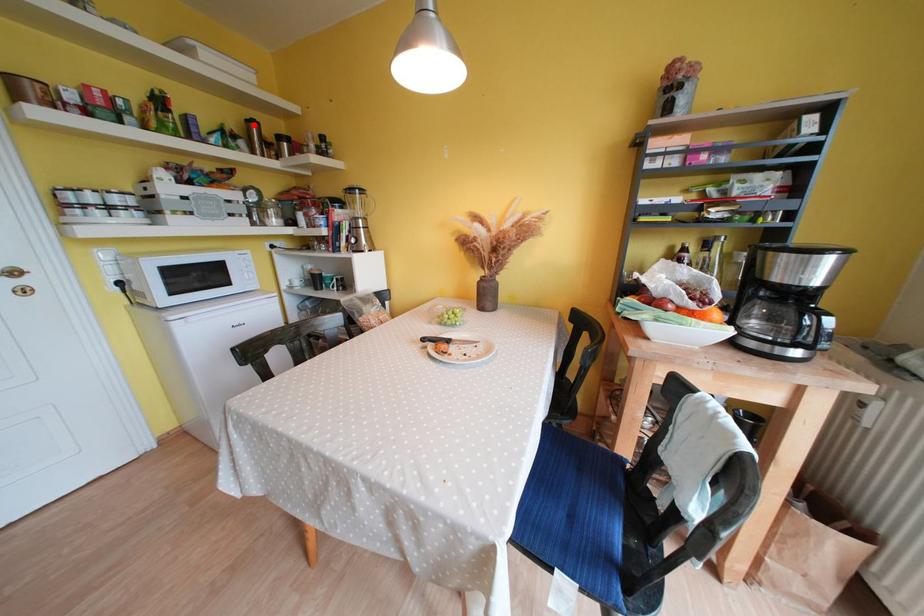
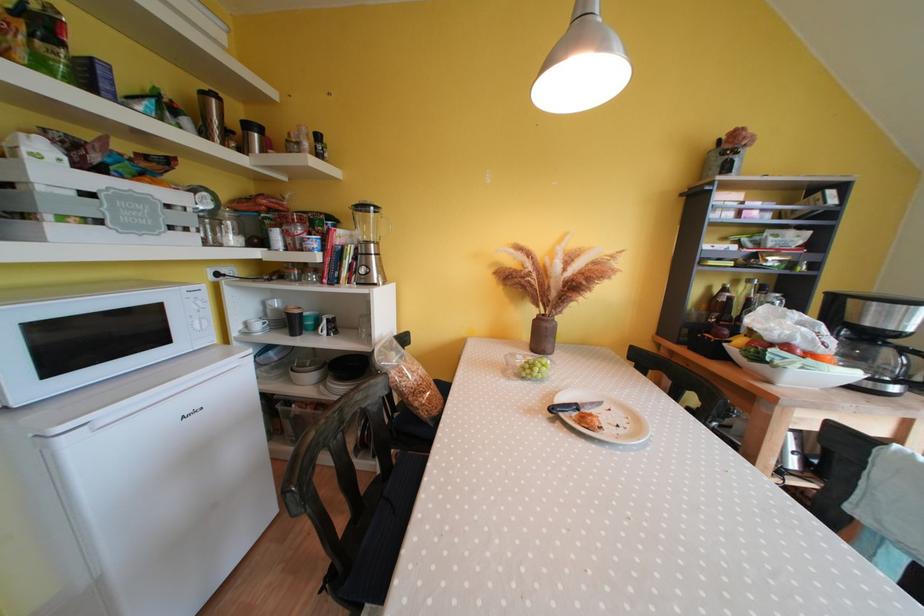
In the second image, find the point that corresponds to the highlighted location in the first image.

(209, 98)